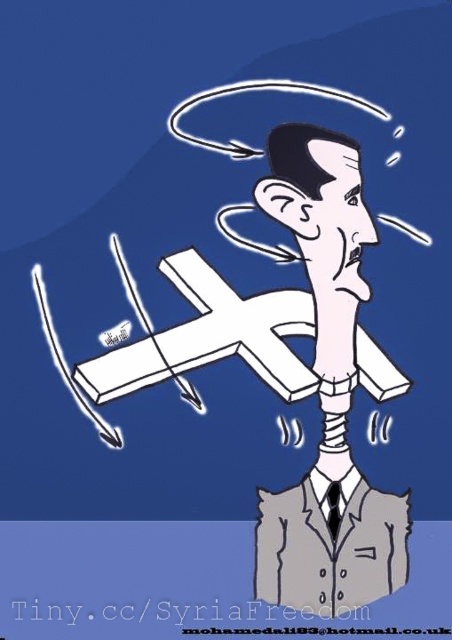
Question: Which object is closer to the camera taking this photo?

Choices:
 (A) gray fabric business suit at center
 (B) white matte cross at center
 (C) gray suit at center

Answer: (B)

Question: Which point is farther to the camera?

Choices:
 (A) gray suit at center
 (B) gray fabric business suit at center

Answer: (A)

Question: Is gray suit at center to the right of gray fabric business suit at center from the viewer's perspective?

Choices:
 (A) no
 (B) yes

Answer: (A)

Question: Which point is farther to the camera?

Choices:
 (A) gray fabric business suit at center
 (B) white matte cross at center

Answer: (A)

Question: Is gray suit at center thinner than gray fabric business suit at center?

Choices:
 (A) no
 (B) yes

Answer: (B)

Question: Is gray suit at center thinner than gray fabric business suit at center?

Choices:
 (A) yes
 (B) no

Answer: (A)